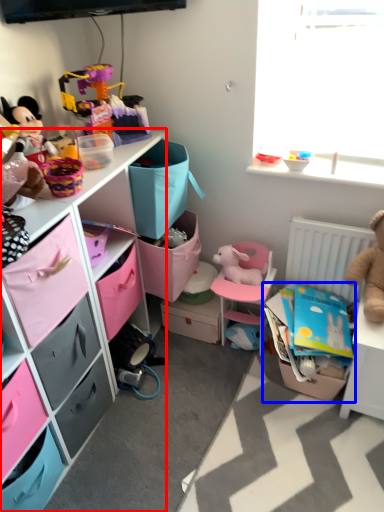
Question: Among these objects, which one is farthest to the camera, cabinetry (highlighted by a red box) or storage box (highlighted by a blue box)?

Choices:
 (A) cabinetry
 (B) storage box

Answer: (B)